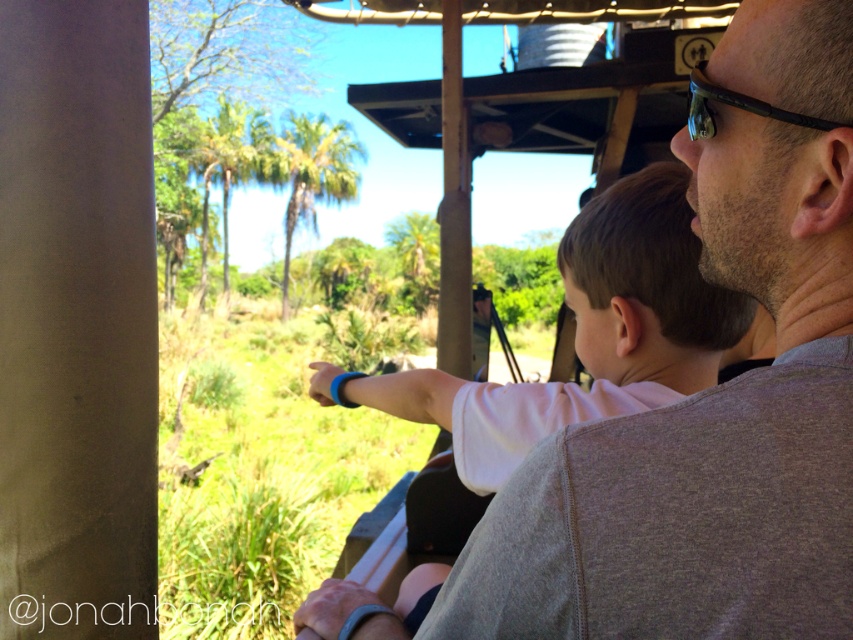
Can you confirm if white cotton shirt at center is positioned to the right of black plastic sunglasses at upper right?

In fact, white cotton shirt at center is to the left of black plastic sunglasses at upper right.

Does white cotton shirt at center have a lesser height compared to black plastic sunglasses at upper right?

No.

Image resolution: width=853 pixels, height=640 pixels. What do you see at coordinates (584, 333) in the screenshot? I see `white cotton shirt at center` at bounding box center [584, 333].

Locate an element on the screen. white cotton shirt at center is located at coordinates (584, 333).